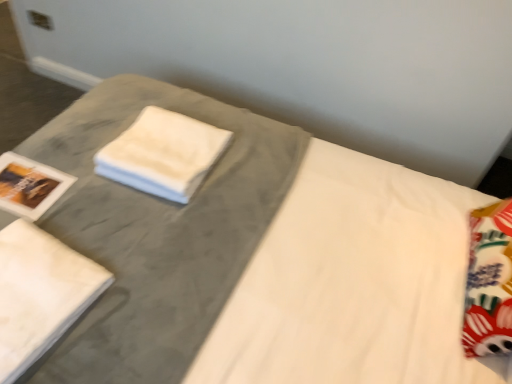
You are a GUI agent. You are given a task and a screenshot of the screen. Output one action in this format:
    pyautogui.click(x=<x>, y=<y>)
    Task: Click on the white soft cloth at center
    
    Given the screenshot: What is the action you would take?
    pyautogui.click(x=163, y=154)

The height and width of the screenshot is (384, 512). What do you see at coordinates (163, 154) in the screenshot?
I see `white soft cloth at center` at bounding box center [163, 154].

What is the approximate height of white soft cloth at center?

8.34 centimeters.

Measure the distance between white soft cloth at center and camera.

1.38 meters.

Where is `white cotton bath towel at lower left`? The height and width of the screenshot is (384, 512). white cotton bath towel at lower left is located at coordinates (40, 293).

The height and width of the screenshot is (384, 512). Describe the element at coordinates (40, 293) in the screenshot. I see `white cotton bath towel at lower left` at that location.

The width and height of the screenshot is (512, 384). What are the coordinates of `white soft cloth at center` in the screenshot? It's located at (163, 154).

Which is more to the left, white soft cloth at center or white cotton bath towel at lower left?

Positioned to the left is white cotton bath towel at lower left.

Is white soft cloth at center in front of or behind white cotton bath towel at lower left in the image?

In the image, white soft cloth at center appears behind white cotton bath towel at lower left.

Is point (210, 149) behind point (27, 251)?

Yes, it is.

From the image's perspective, which is above, white soft cloth at center or white cotton bath towel at lower left?

white soft cloth at center is shown above in the image.

From a real-world perspective, is white soft cloth at center physically above white cotton bath towel at lower left?

Yes, from a real-world perspective, white soft cloth at center is above white cotton bath towel at lower left.

Considering the relative sizes of white soft cloth at center and white cotton bath towel at lower left in the image provided, is white soft cloth at center thinner than white cotton bath towel at lower left?

Correct, the width of white soft cloth at center is less than that of white cotton bath towel at lower left.

In terms of height, does white soft cloth at center look taller or shorter compared to white cotton bath towel at lower left?

white soft cloth at center is taller than white cotton bath towel at lower left.

Between white soft cloth at center and white cotton bath towel at lower left, which one has smaller size?

Smaller between the two is white cotton bath towel at lower left.

Is white soft cloth at center completely or partially outside of white cotton bath towel at lower left?

Absolutely, white soft cloth at center is external to white cotton bath towel at lower left.

Is white soft cloth at center placed right next to white cotton bath towel at lower left?

white soft cloth at center and white cotton bath towel at lower left are not in contact.

Is white soft cloth at center turned away from white cotton bath towel at lower left?

No, white soft cloth at center's orientation is not away from white cotton bath towel at lower left.

How many degrees apart are the facing directions of white soft cloth at center and white cotton bath towel at lower left?

The angle between the facing direction of white soft cloth at center and the facing direction of white cotton bath towel at lower left is 5.52 degrees.

The width and height of the screenshot is (512, 384). In order to click on bath towel located below the white soft cloth at center (from the image's perspective) in this screenshot , I will do `click(40, 293)`.

Which is more to the right, white cotton bath towel at lower left or white soft cloth at center?

white soft cloth at center is more to the right.

Considering their positions, is white cotton bath towel at lower left located in front of or behind white soft cloth at center?

Clearly, white cotton bath towel at lower left is in front of white soft cloth at center.

Is point (45, 270) closer to viewer compared to point (116, 154)?

That is True.

Consider the image. From the image's perspective, which is below, white cotton bath towel at lower left or white soft cloth at center?

white cotton bath towel at lower left, from the image's perspective.

From a real-world perspective, is white cotton bath towel at lower left above or below white soft cloth at center?

Clearly, from a real-world perspective, white cotton bath towel at lower left is below white soft cloth at center.

Looking at this image, can you confirm if white cotton bath towel at lower left is thinner than white soft cloth at center?

In fact, white cotton bath towel at lower left might be wider than white soft cloth at center.

Does white cotton bath towel at lower left have a lesser height compared to white soft cloth at center?

Yes, white cotton bath towel at lower left is shorter than white soft cloth at center.

Looking at this image, based on their sizes in the image, would you say white cotton bath towel at lower left is bigger or smaller than white soft cloth at center?

Considering their sizes, white cotton bath towel at lower left takes up less space than white soft cloth at center.

Choose the correct answer: Is white cotton bath towel at lower left inside white soft cloth at center or outside it?

white cotton bath towel at lower left is not inside white soft cloth at center, it's outside.

Does white cotton bath towel at lower left touch white soft cloth at center?

white cotton bath towel at lower left is not next to white soft cloth at center, and they're not touching.

Is white cotton bath towel at lower left aimed at white soft cloth at center?

No, white cotton bath towel at lower left is not turned towards white soft cloth at center.

How many degrees apart are the facing directions of white cotton bath towel at lower left and white soft cloth at center?

5.52 degrees.

Locate an element on the screen. cloth positioned vertically above the white cotton bath towel at lower left (from a real-world perspective) is located at coordinates (163, 154).

I want to click on bath towel that is below the white soft cloth at center (from the image's perspective), so click(40, 293).

Locate an element on the screen. bath towel in front of the white soft cloth at center is located at coordinates (40, 293).